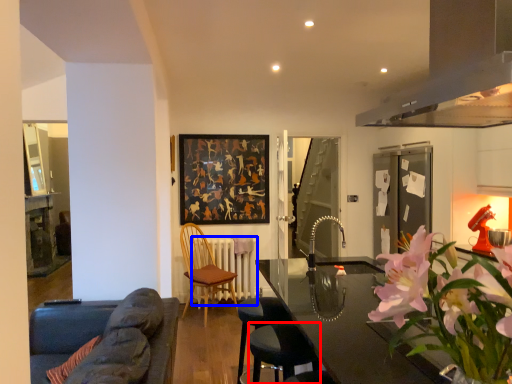
Question: Among these objects, which one is farthest to the camera, bar stool (highlighted by a red box) or radiator (highlighted by a blue box)?

Choices:
 (A) bar stool
 (B) radiator

Answer: (B)